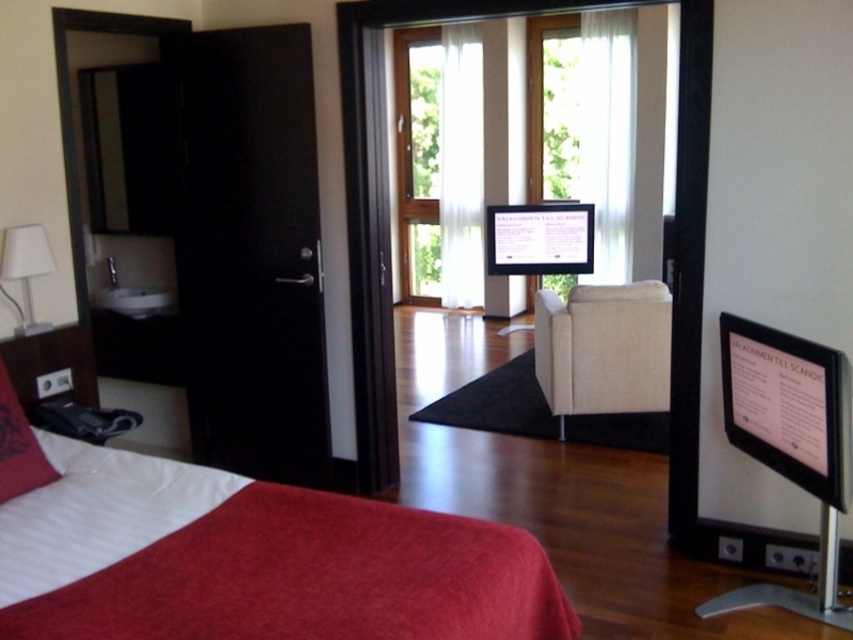
In the scene shown: You are a hotel guest who wants to choose between the velvet red bed at lower left and the beige fabric armchair at center for a comfortable nap. Based on their sizes, which one would you recommend for better comfort?

The velvet red bed at lower left is larger in size than the beige fabric armchair at center, so it would provide more space and comfort for a nap.

You are standing in the hotel room and want to walk from the bed to the lounge area. Which point, point (548,1) or point (595,372), is closer to the doorway leading to the lounge area?

Point (548,1) is in front of point (595,372), so it is closer to the doorway leading to the lounge area.

You are a hotel guest who just entered the room and wants to sit in the closest available seating. The velvet red bed at lower left and the beige fabric armchair at center are both available. Which one is closer to your current position at the entrance?

The velvet red bed at lower left is closer because it is only 2.42 meters away from the beige fabric armchair at center. Since you entered the room, the bed is likely positioned near the entrance, making it the closer option.